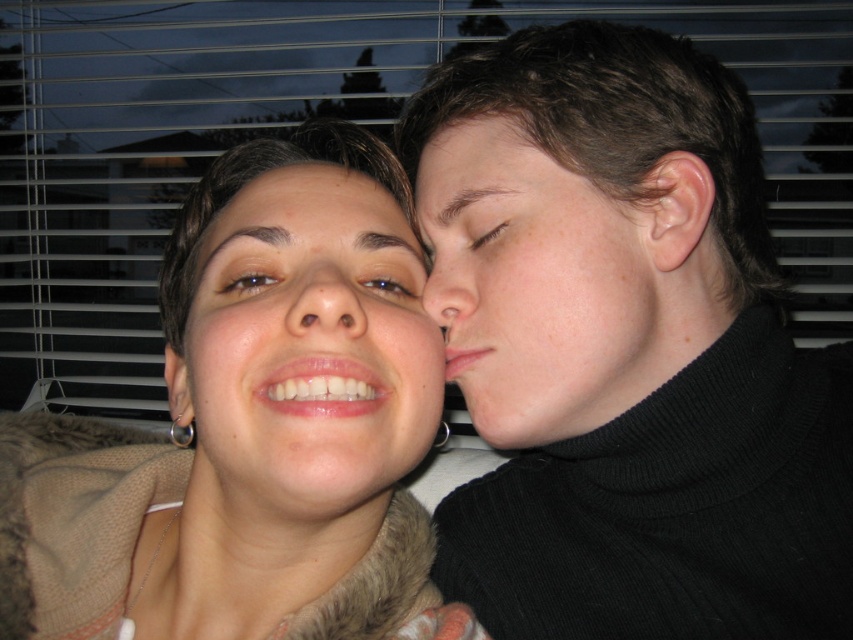
Based on the scene description, where is the matte skin nose at center located in terms of its 2D coordinates?

The matte skin nose at center is located at the 2D coordinates point (322, 300).

You are an artist trying to draw the scene. You need to place the white fur at upper center and the smooth skin nose at center correctly. Which object should be drawn higher on the paper?

The white fur at upper center should be drawn higher on the paper since it is located above the smooth skin nose at center.

You are designing a catalog layout where the fuzzy brown sweater at upper left and the matte fur at center need to be displayed side by side. Given their sizes, which object should be placed higher on the page to maintain visual balance?

The fuzzy brown sweater at upper left has a greater height compared to matte fur at center, so placing it higher on the page would help maintain visual balance by compensating for its larger size.